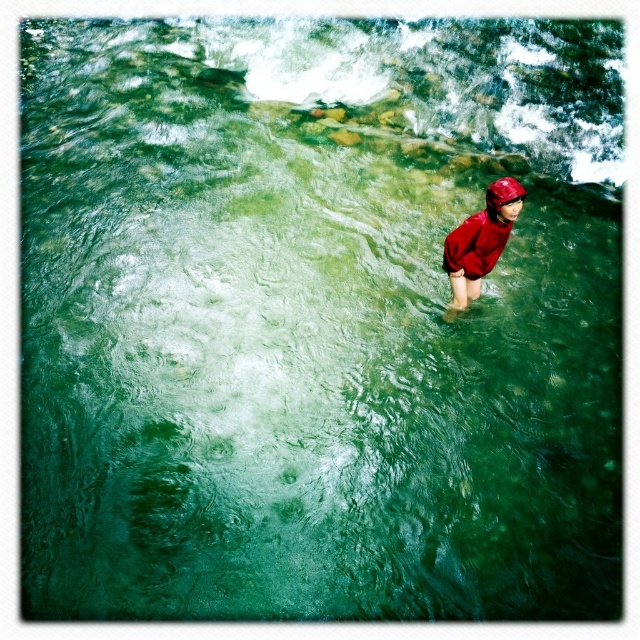
You are a hiker who wants to cross the river safely. You see the matte red raincoat at center and the red matte helmet at upper center in the river. Which object is taller and could potentially block your path?

The matte red raincoat at center is much taller than the red matte helmet at upper center, so it could potentially block your path more than the helmet.

In the scene shown: You are a hiker who wants to cross the river safely. You see the point at coordinates (x=481, y=241) where the matte red raincoat at center is located. Is this point a safe place to step on?

The point at coordinates (x=481, y=241) is where the matte red raincoat at center is located. Since the person is standing there partially submerged up to their knees, it is a safe place to step on as the water depth is manageable.

You are a photographer trying to capture the person in the river. You want to ensure both the matte red raincoat at center and the red matte helmet at upper center are clearly visible in your shot. Which object should you focus on first to ensure proper framing, considering their sizes?

The matte red raincoat at center is wider than the red matte helmet at upper center. Therefore, you should focus on the matte red raincoat at center first to ensure it fits within the frame, as it occupies more space.